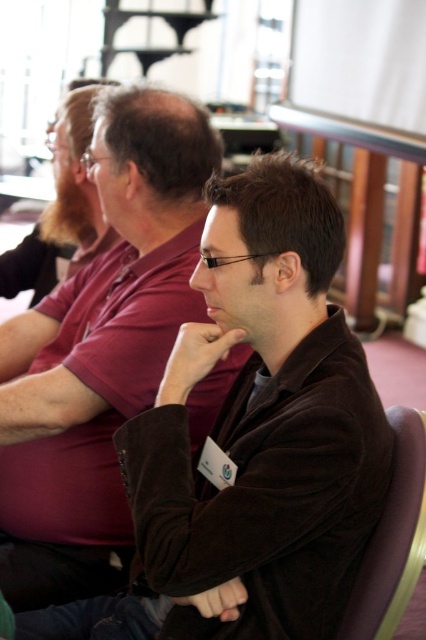
Question: Can you confirm if brown velvety shirt at center is positioned above purple fabric chair at lower right?

Choices:
 (A) no
 (B) yes

Answer: (B)

Question: Is brown velvety shirt at center above purple fabric chair at lower right?

Choices:
 (A) yes
 (B) no

Answer: (A)

Question: Which point is farther to the camera?

Choices:
 (A) (100, 336)
 (B) (374, 573)

Answer: (A)

Question: Which point appears farthest from the camera in this image?

Choices:
 (A) (43, 484)
 (B) (420, 490)

Answer: (A)

Question: From the image, what is the correct spatial relationship of brown velvety shirt at center in relation to purple fabric chair at lower right?

Choices:
 (A) below
 (B) above

Answer: (B)

Question: Which of the following is the farthest from the observer?

Choices:
 (A) (391, 483)
 (B) (132, 282)

Answer: (B)